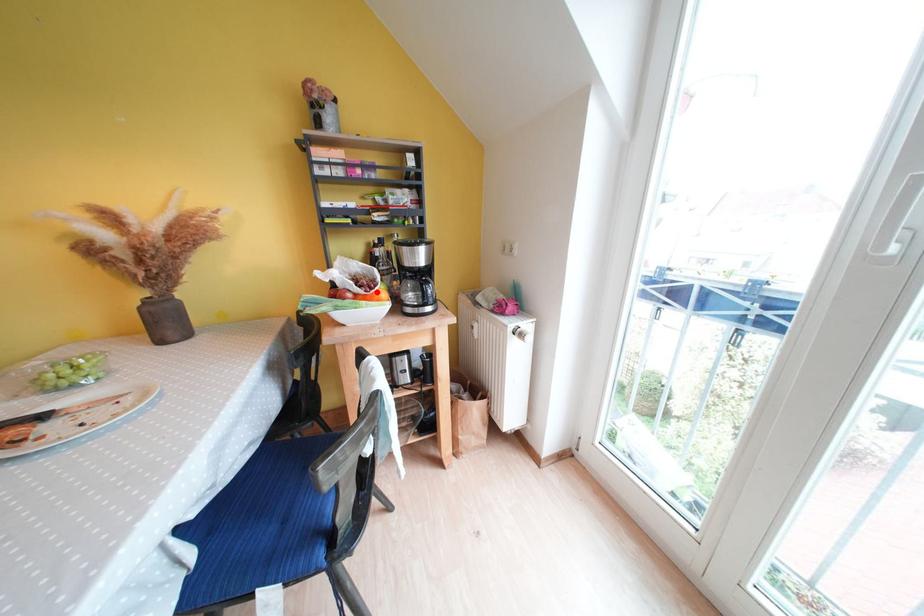
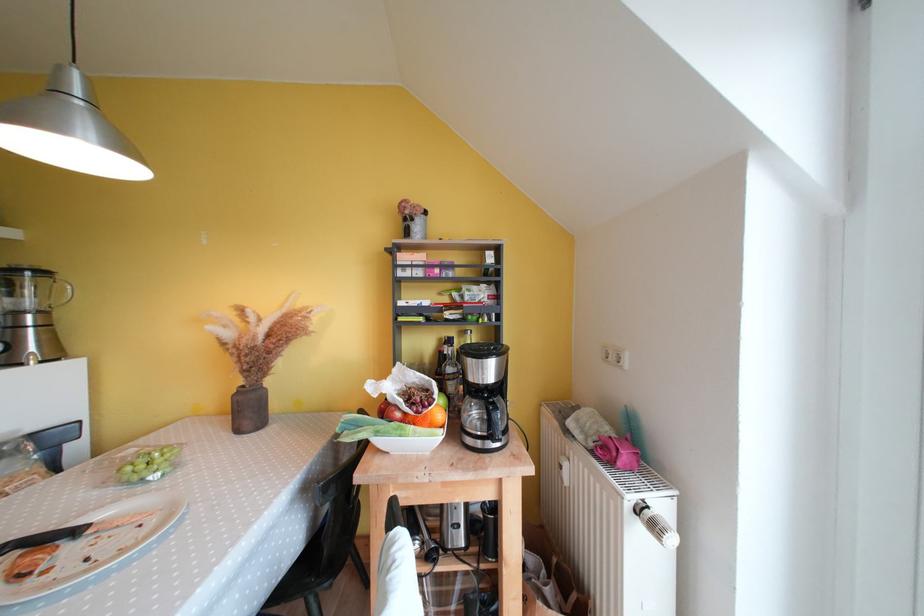
Find the pixel in the second image that matches the highlighted location in the first image.

(431, 411)